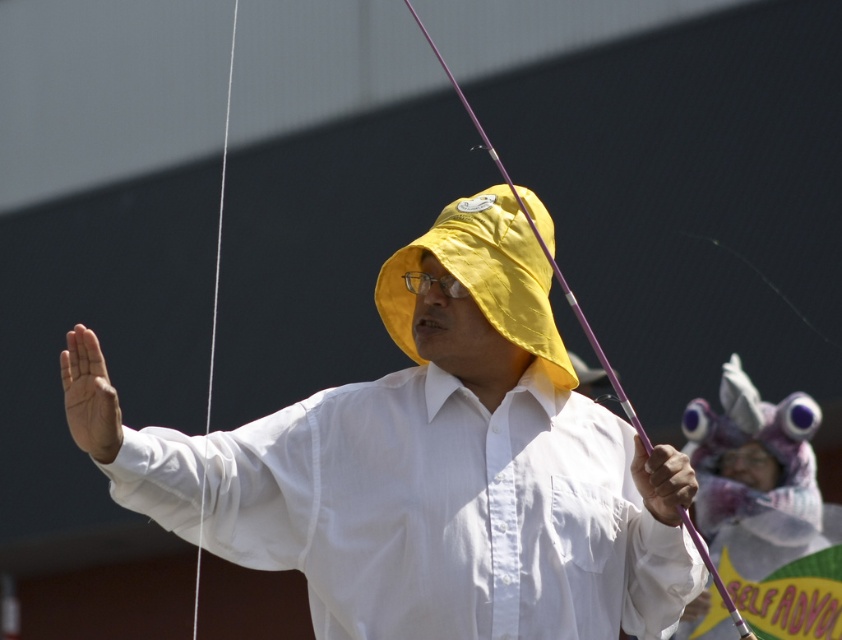
You are a photographer trying to capture a clear shot of both the yellow fabric hat at center and the purple glossy fishing pole at center. Since you want both objects to be in focus, which one should you adjust your camera focus on first?

The yellow fabric hat at center is further to the viewer than the purple glossy fishing pole at center, so you should focus on the yellow fabric hat at center first to ensure both are in focus.